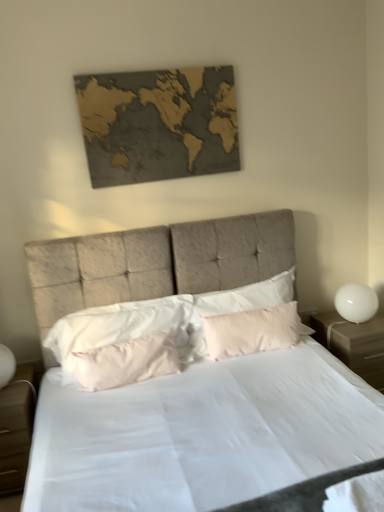
What is the approximate width of white glossy nightstand at right, the 2th nightstand from the left?

white glossy nightstand at right, the 2th nightstand from the left, is 18.28 inches wide.

Identify the location of pink satin pillow at center, positioned as the 2th pillow in left-to-right order. The height and width of the screenshot is (512, 384). (124, 361).

The height and width of the screenshot is (512, 384). What do you see at coordinates (156, 262) in the screenshot?
I see `matte beige bed at center` at bounding box center [156, 262].

In order to face pink fabric pillow at center, positioned as the 1th pillow in right-to-left order, should I rotate leftwards or rightwards?

Turn right approximately 7.555 degrees to face it.

This screenshot has width=384, height=512. I want to click on gold textured map at upper center, so click(158, 124).

Can you confirm if pink fabric pillow at center, the 3th pillow when ordered from left to right, is wider than gold textured map at upper center?

Yes.

Considering the points (189, 339) and (140, 116), which point is behind, point (189, 339) or point (140, 116)?

Positioned behind is point (189, 339).

Is pink fabric pillow at center, positioned as the 1th pillow in right-to-left order, touching gold textured map at upper center?

No, pink fabric pillow at center, positioned as the 1th pillow in right-to-left order, is not touching gold textured map at upper center.

Which object is positioned more to the left, pink satin pillow at center, the 2th pillow when ordered from right to left, or white glossy nightstand at right, the 2th nightstand from the left?

Positioned to the left is pink satin pillow at center, the 2th pillow when ordered from right to left.

Choose the correct answer: Is pink satin pillow at center, the 2th pillow when ordered from right to left, inside white glossy nightstand at right, positioned as the first nightstand in right-to-left order, or outside it?

The correct answer is: outside.

How different are the orientations of pink satin pillow at center, the 2th pillow when ordered from right to left, and white glossy nightstand at right, the 2th nightstand from the left, in degrees?

The angular difference between pink satin pillow at center, the 2th pillow when ordered from right to left, and white glossy nightstand at right, the 2th nightstand from the left, is 5.51 degrees.

From a real-world perspective, which object stands above the other?

From a 3D spatial view, pink satin pillow at center, positioned as the 2th pillow in left-to-right order, is above.

Is the position of silky white pillow at center, arranged as the 1th pillow when viewed from the left, less distant than that of pink fabric pillow at center, positioned as the 1th pillow in right-to-left order?

That is True.

From the image's perspective, is silky white pillow at center, the third pillow in the right-to-left sequence, located above pink fabric pillow at center, positioned as the 1th pillow in right-to-left order?

Incorrect, from the image's perspective, silky white pillow at center, the third pillow in the right-to-left sequence, is lower than pink fabric pillow at center, positioned as the 1th pillow in right-to-left order.

Do you think silky white pillow at center, arranged as the 1th pillow when viewed from the left, is within pink fabric pillow at center, the 3th pillow when ordered from left to right, or outside of it?

silky white pillow at center, arranged as the 1th pillow when viewed from the left, is not enclosed by pink fabric pillow at center, the 3th pillow when ordered from left to right.

Is point (95, 329) closer to viewer compared to point (260, 308)?

Yes.

Relative to pink fabric pillow at center, the 3th pillow when ordered from left to right, is gold textured map at upper center in front or behind?

gold textured map at upper center is positioned closer to the viewer than pink fabric pillow at center, the 3th pillow when ordered from left to right.

How different are the orientations of gold textured map at upper center and pink fabric pillow at center, positioned as the 1th pillow in right-to-left order, in degrees?

The angular difference between gold textured map at upper center and pink fabric pillow at center, positioned as the 1th pillow in right-to-left order, is 2.23 degrees.

Consider the image. In terms of width, does gold textured map at upper center look wider or thinner when compared to pink fabric pillow at center, the 3th pillow when ordered from left to right?

Clearly, gold textured map at upper center has less width compared to pink fabric pillow at center, the 3th pillow when ordered from left to right.

Is pink satin pillow at center, positioned as the 2th pillow in left-to-right order, inside white glossy sphere at right?

No, pink satin pillow at center, positioned as the 2th pillow in left-to-right order, is not a part of white glossy sphere at right.

Are white glossy sphere at right and pink satin pillow at center, positioned as the 2th pillow in left-to-right order, far apart?

That's right, there is a large distance between white glossy sphere at right and pink satin pillow at center, positioned as the 2th pillow in left-to-right order.

From the image's perspective, is white glossy sphere at right positioned above or below pink satin pillow at center, the 2th pillow when ordered from right to left?

Clearly, from the image's perspective, white glossy sphere at right is above pink satin pillow at center, the 2th pillow when ordered from right to left.

How much distance is there between white glossy sphere at right and pink satin pillow at center, the 2th pillow when ordered from right to left?

1.26 meters.

Based on the photo, would you consider white glossy sphere at right to be distant from white glossy nightstand at right, the 2th nightstand from the left?

white glossy sphere at right is near white glossy nightstand at right, the 2th nightstand from the left, not far away.

In terms of size, does white glossy sphere at right appear bigger or smaller than white glossy nightstand at right, the 2th nightstand from the left?

Clearly, white glossy sphere at right is smaller in size than white glossy nightstand at right, the 2th nightstand from the left.

From a real-world perspective, which is physically above, white glossy sphere at right or white glossy nightstand at right, positioned as the first nightstand in right-to-left order?

In real-world perspective, white glossy sphere at right is above.

From the image's perspective, relative to white glossy sphere at right, is pink satin pillow at center, the 2th pillow when ordered from right to left, above or below?

From the image's perspective, pink satin pillow at center, the 2th pillow when ordered from right to left, appears below white glossy sphere at right.

Is pink satin pillow at center, positioned as the 2th pillow in left-to-right order, looking in the opposite direction of white glossy sphere at right?

No, pink satin pillow at center, positioned as the 2th pillow in left-to-right order, is not facing away from white glossy sphere at right.

Considering the points (173, 345) and (352, 319), which point is in front, point (173, 345) or point (352, 319)?

Positioned in front is point (173, 345).

Is pink satin pillow at center, the 2th pillow when ordered from right to left, completely or partially outside of white glossy sphere at right?

pink satin pillow at center, the 2th pillow when ordered from right to left, lies outside white glossy sphere at right's area.

The width and height of the screenshot is (384, 512). In order to click on the 1st pillow below when counting from the gold textured map at upper center (from the image's perspective) in this screenshot , I will do coord(236,305).

I want to click on the 1st pillow above the white glossy nightstand at right, positioned as the first nightstand in right-to-left order (from the image's perspective), so click(x=124, y=361).

Estimate the real-world distances between objects in this image. Which object is closer to silky white pillow at center, the third pillow in the right-to-left sequence, white glossy sphere at right or light brown wood nightstand at lower left, which appears as the 2th nightstand when viewed from the right?

Among the two, light brown wood nightstand at lower left, which appears as the 2th nightstand when viewed from the right, is located nearer to silky white pillow at center, the third pillow in the right-to-left sequence.

Considering their positions, is pink fabric pillow at center, positioned as the 1th pillow in right-to-left order, positioned closer to light brown wood nightstand at lower left, marked as the first nightstand in a left-to-right arrangement, than white glossy nightstand at right, positioned as the first nightstand in right-to-left order?

pink fabric pillow at center, positioned as the 1th pillow in right-to-left order, is closer to light brown wood nightstand at lower left, marked as the first nightstand in a left-to-right arrangement.

From the image, which object appears to be nearer to gold textured map at upper center, pink fabric pillow at center, the 3th pillow when ordered from left to right, or silky white pillow at center, the third pillow in the right-to-left sequence?

silky white pillow at center, the third pillow in the right-to-left sequence, lies closer to gold textured map at upper center than the other object.

Looking at the image, which one is located further to pink satin pillow at center, positioned as the 2th pillow in left-to-right order, pink fabric pillow at center, the 3th pillow when ordered from left to right, or matte beige bed at center?

The object further to pink satin pillow at center, positioned as the 2th pillow in left-to-right order, is matte beige bed at center.

When comparing their distances from silky white pillow at center, the third pillow in the right-to-left sequence, does pink satin pillow at center, positioned as the 2th pillow in left-to-right order, or white glossy sphere at right seem further?

Among the two, white glossy sphere at right is located further to silky white pillow at center, the third pillow in the right-to-left sequence.

From the image, which object appears to be nearer to gold textured map at upper center, white glossy sphere at right or pink fabric pillow at center, positioned as the 1th pillow in right-to-left order?

Based on the image, pink fabric pillow at center, positioned as the 1th pillow in right-to-left order, appears to be nearer to gold textured map at upper center.

Considering their positions, is silky white pillow at center, arranged as the 1th pillow when viewed from the left, positioned further to white glossy sphere at right than white glossy nightstand at right, the 2th nightstand from the left?

The object further to white glossy sphere at right is silky white pillow at center, arranged as the 1th pillow when viewed from the left.

Based on the photo, based on their spatial positions, is light brown wood nightstand at lower left, marked as the first nightstand in a left-to-right arrangement, or white glossy nightstand at right, positioned as the first nightstand in right-to-left order, further from gold textured map at upper center?

light brown wood nightstand at lower left, marked as the first nightstand in a left-to-right arrangement, lies further to gold textured map at upper center than the other object.

Image resolution: width=384 pixels, height=512 pixels. I want to click on pillow between pink satin pillow at center, the 2th pillow when ordered from right to left, and white glossy sphere at right from left to right, so click(x=236, y=305).

Locate an element on the screen. The image size is (384, 512). bedside lamp located between light brown wood nightstand at lower left, marked as the first nightstand in a left-to-right arrangement, and white glossy nightstand at right, the 2th nightstand from the left, in the left-right direction is located at coordinates (x=356, y=302).

Locate an element on the screen. This screenshot has width=384, height=512. pillow between gold textured map at upper center and silky white pillow at center, arranged as the 1th pillow when viewed from the left, in the vertical direction is located at coordinates (236, 305).

You are a GUI agent. You are given a task and a screenshot of the screen. Output one action in this format:
    pyautogui.click(x=<x>, y=<y>)
    Task: Click on the picture frame between matte beige bed at center and white glossy sphere at right from front to back
    This screenshot has width=384, height=512.
    Given the screenshot: What is the action you would take?
    pyautogui.click(x=158, y=124)